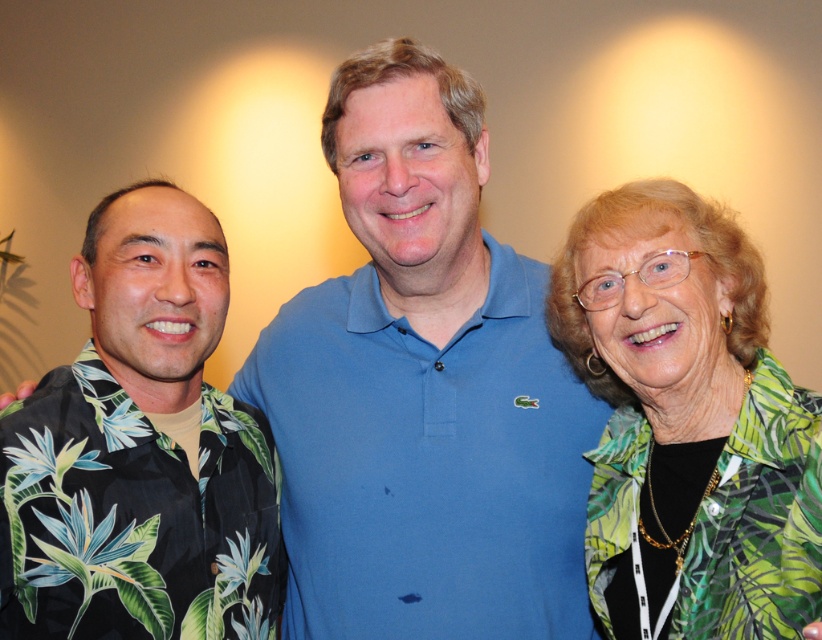
Which is more to the left, black floral shirt at left or green leafy blouse at right?

black floral shirt at left

Between black floral shirt at left and green leafy blouse at right, which one is positioned lower?

black floral shirt at left is below.

In the scene shown: Who is more distant from viewer, (185, 630) or (724, 429)?

Positioned behind is point (724, 429).

Find the location of a particular element. The image size is (822, 640). black floral shirt at left is located at coordinates (141, 452).